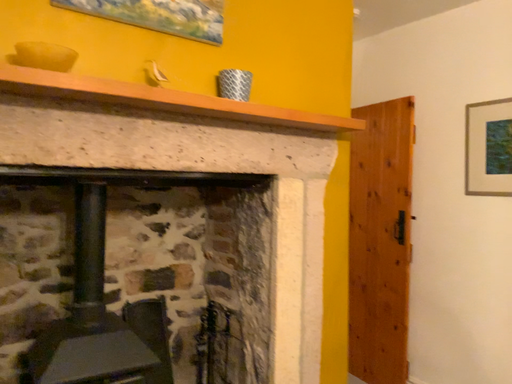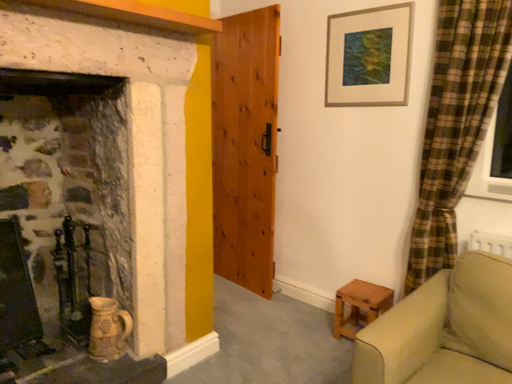
Question: Which way did the camera rotate in the video?

Choices:
 (A) rotated right
 (B) rotated left

Answer: (A)